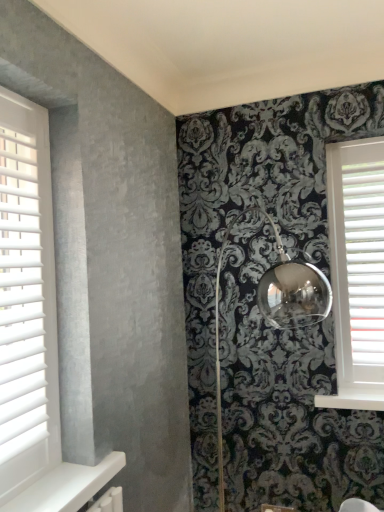
Question: Is white plastic blinds at right in front of or behind white wood blinds at left in the image?

Choices:
 (A) behind
 (B) front

Answer: (A)

Question: Based on their sizes in the image, would you say white plastic blinds at right is bigger or smaller than white wood blinds at left?

Choices:
 (A) small
 (B) big

Answer: (A)

Question: Which is nearer to the white painted wood at lower right?

Choices:
 (A) white wood blinds at left
 (B) white plastic blinds at right

Answer: (B)

Question: Which of these objects is positioned closest to the white painted wood at lower right?

Choices:
 (A) white wood blinds at left
 (B) white plastic blinds at right

Answer: (B)